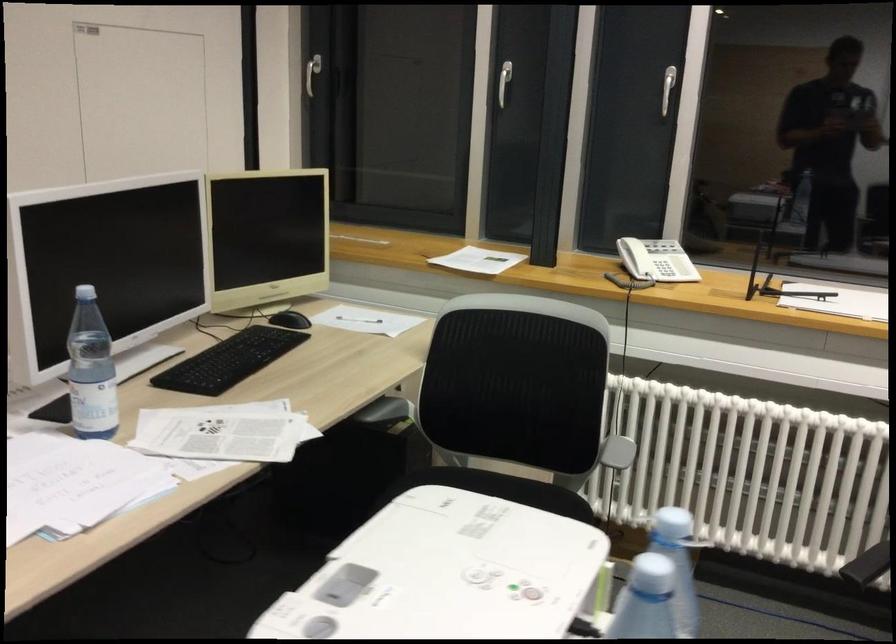
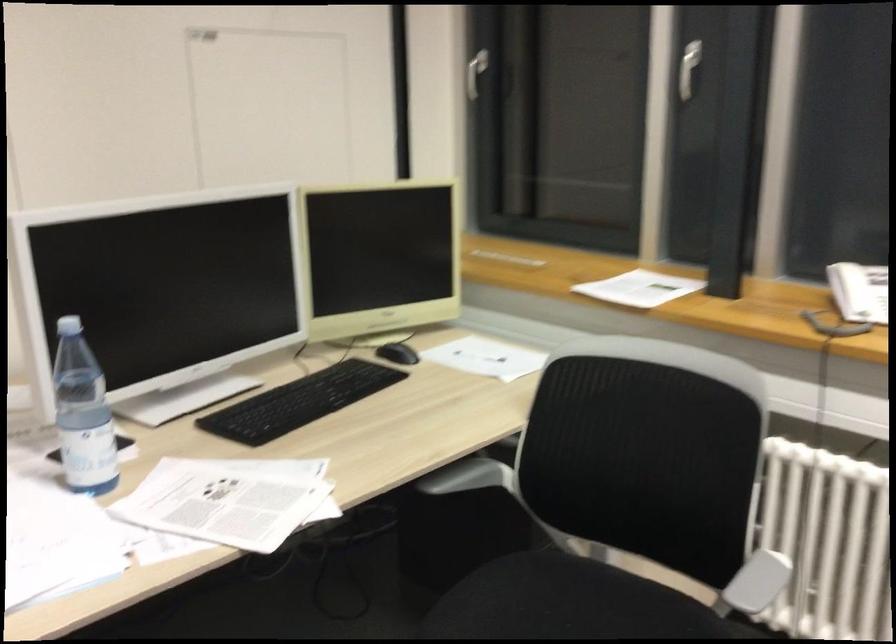
The point at (617, 450) is marked in the first image. Where is the corresponding point in the second image?

(757, 582)